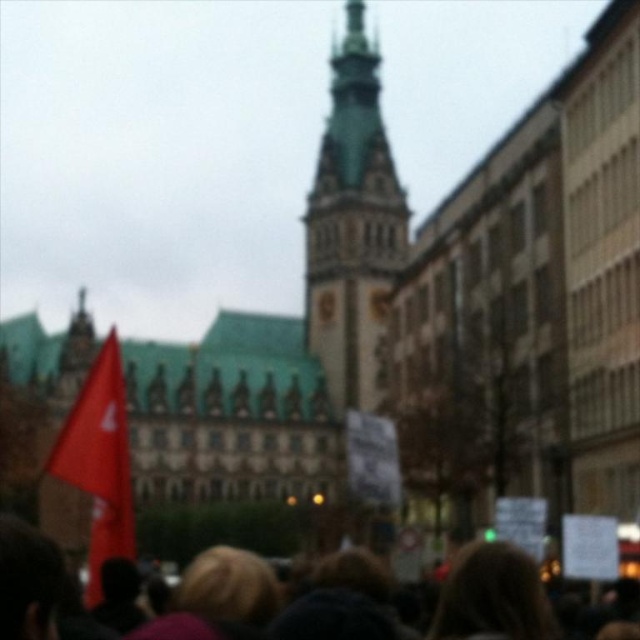
Which of these two, matte red flag at left or blurred hair at lower center, stands shorter?

blurred hair at lower center is shorter.

Is matte red flag at left to the left of blurred hair at lower center from the viewer's perspective?

Correct, you'll find matte red flag at left to the left of blurred hair at lower center.

The image size is (640, 640). Find the location of `matte red flag at left`. matte red flag at left is located at coordinates tap(99, 461).

Can you confirm if green stone tower at center is positioned above matte red flag at left?

Correct, green stone tower at center is located above matte red flag at left.

Can you confirm if green stone tower at center is positioned to the right of matte red flag at left?

Correct, you'll find green stone tower at center to the right of matte red flag at left.

Locate an element on the screen. This screenshot has height=640, width=640. green stone tower at center is located at coordinates (353, 227).

Where is `green stone tower at center`? Image resolution: width=640 pixels, height=640 pixels. green stone tower at center is located at coordinates (353, 227).

Who is positioned more to the right, green stone tower at center or blurred hair at lower center?

From the viewer's perspective, green stone tower at center appears more on the right side.

The height and width of the screenshot is (640, 640). Identify the location of green stone tower at center. [353, 227].